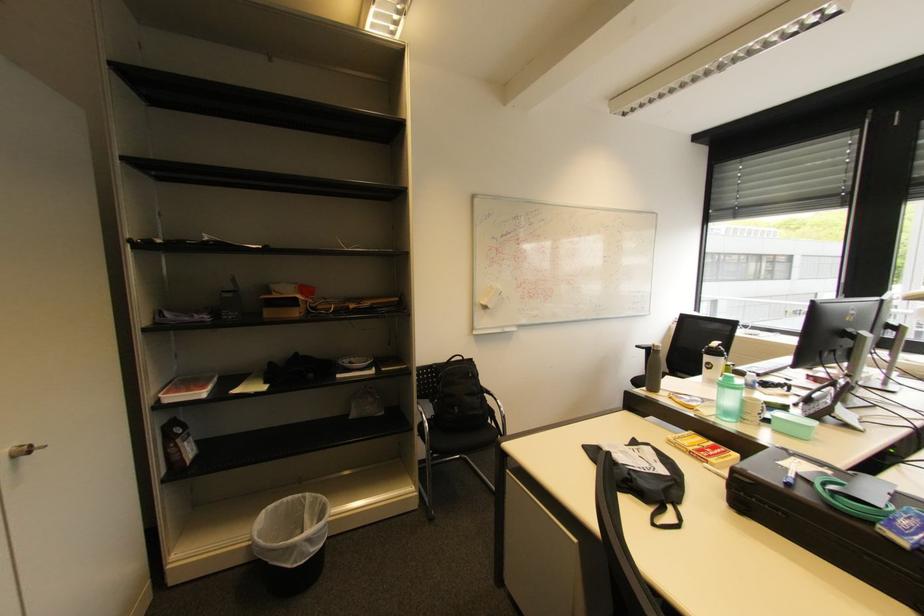
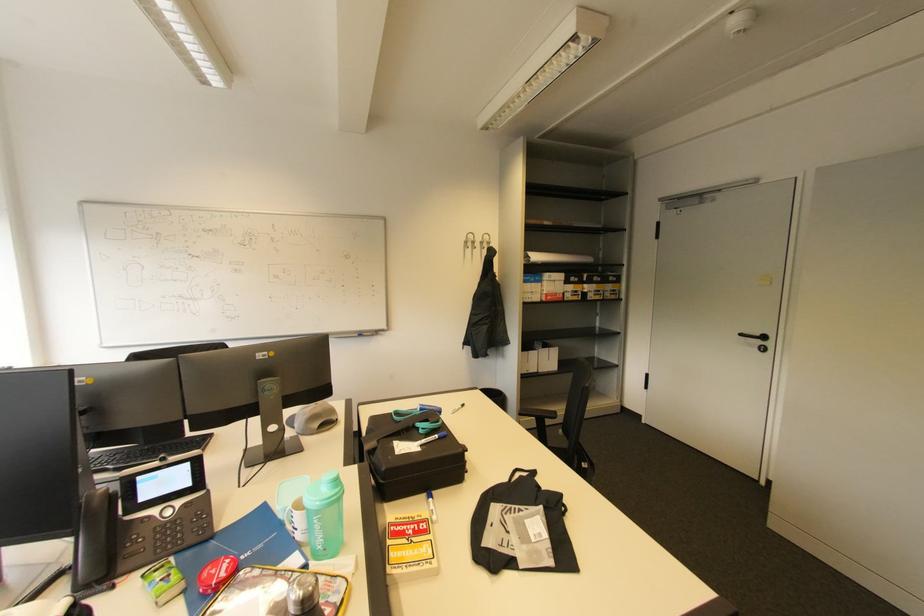
Where in the second image is the point corresponding to point 800,459 from the first image?

(402, 455)